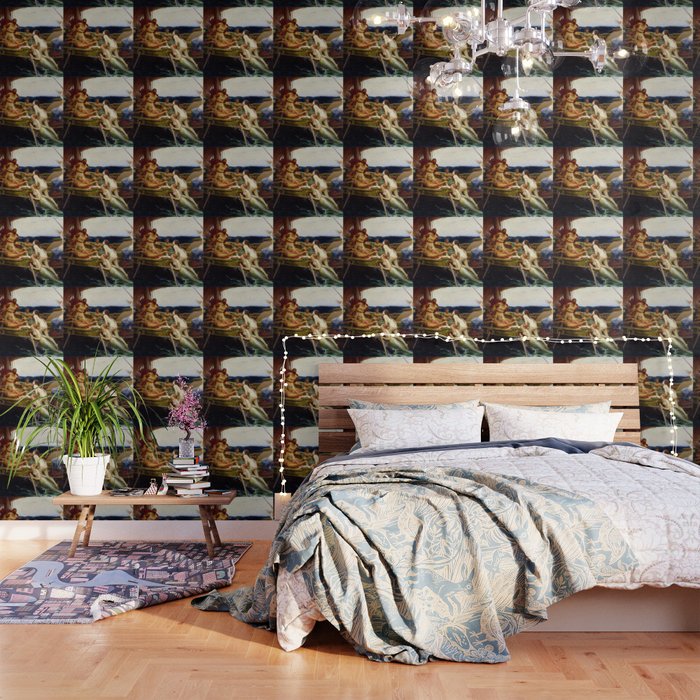
You are a GUI agent. You are given a task and a screenshot of the screen. Output one action in this format:
    pyautogui.click(x=<x>, y=<y>)
    Task: Click on the pillow
    The height and width of the screenshot is (700, 700).
    Given the screenshot: What is the action you would take?
    434,421, 542,425